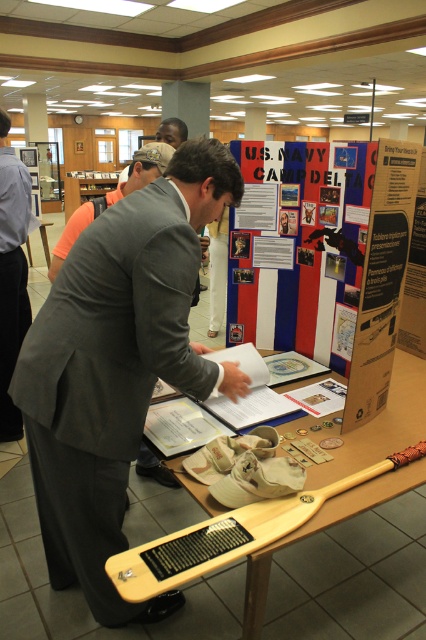
Question: Is matte paper poster at center thinner than wooden paddle at center?

Choices:
 (A) no
 (B) yes

Answer: (B)

Question: Which point is closer to the camera?

Choices:
 (A) gray wool business suit at center
 (B) wooden paddle at center
 (C) gray suit jacket at center
 (D) gray suit at center

Answer: (B)

Question: Can you confirm if matte paper poster at center is positioned below gray suit jacket at center?

Choices:
 (A) yes
 (B) no

Answer: (B)

Question: Observing the image, what is the correct spatial positioning of gray wool business suit at center in reference to matte paper poster at center?

Choices:
 (A) below
 (B) above

Answer: (A)

Question: Which object appears farthest from the camera in this image?

Choices:
 (A) matte paper poster at center
 (B) gray suit at center
 (C) gray suit jacket at center

Answer: (C)

Question: Which object is farther from the camera taking this photo?

Choices:
 (A) gray suit jacket at center
 (B) matte paper poster at center
 (C) gray suit at center
 (D) wooden paddle at center

Answer: (A)